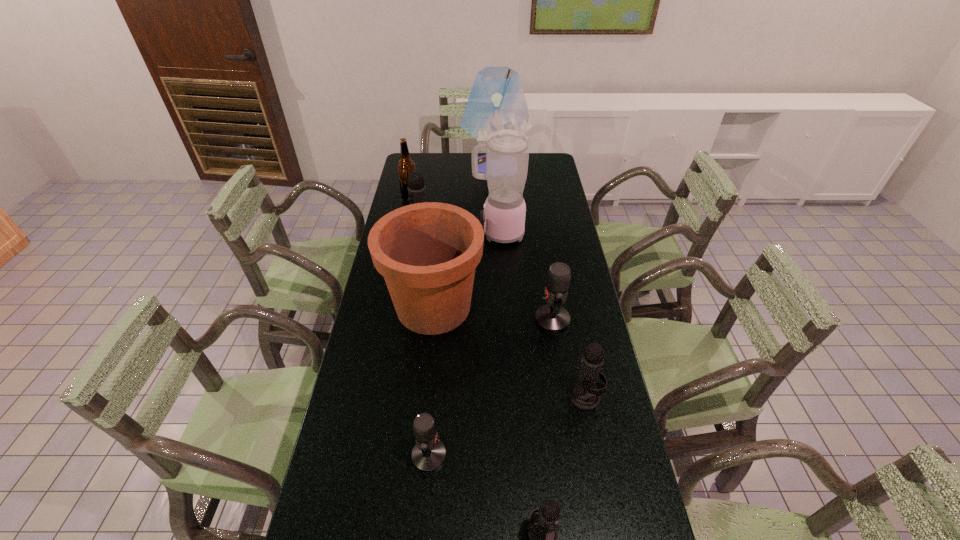
Identify the location of the eighth closest object to the light lampshade. point(543,537).

Locate an element on the screen. The image size is (960, 540). object that can be found as the eighth closest to the third farthest microphone is located at coordinates (496, 102).

Identify which microphone is the fourth closest to the food processor. Please provide its 2D coordinates. Your answer should be formatted as a tuple, i.e. [(x, y)], where the tuple contains the x and y coordinates of a point satisfying the conditions above.

[(429, 453)]

Identify the location of the third closest microphone to the farther red microphone. (416, 187).

Find the location of a particular element. Image resolution: width=960 pixels, height=540 pixels. black microphone that can be found as the closest to the third microphone from left to right is located at coordinates (585, 395).

Where is `black microphone that is the second closest to the nearest object`? The width and height of the screenshot is (960, 540). black microphone that is the second closest to the nearest object is located at coordinates (416, 187).

Locate an element on the screen. vacant region that satisfies the following two spatial constraints: 1. on the label of the flowerpot; 2. on the left side of the beer bottle is located at coordinates (388, 307).

What are the coordinates of `vacant space that satisfies the following two spatial constraints: 1. on the label of the beer bottle; 2. on the left side of the seventh farthest object` in the screenshot? It's located at (369, 396).

Where is `free spot that satisfies the following two spatial constraints: 1. on the base of the food processor near the control knob; 2. on the left side of the second biggest black microphone`? The width and height of the screenshot is (960, 540). free spot that satisfies the following two spatial constraints: 1. on the base of the food processor near the control knob; 2. on the left side of the second biggest black microphone is located at coordinates (507, 396).

You are a GUI agent. You are given a task and a screenshot of the screen. Output one action in this format:
    pyautogui.click(x=<x>, y=<y>)
    Task: Click on the vacant space that satisfies the following two spatial constraints: 1. on the base of the food processor near the control knob; 2. on the back side of the third nearest object
    The height and width of the screenshot is (540, 960).
    Given the screenshot: What is the action you would take?
    pyautogui.click(x=507, y=396)